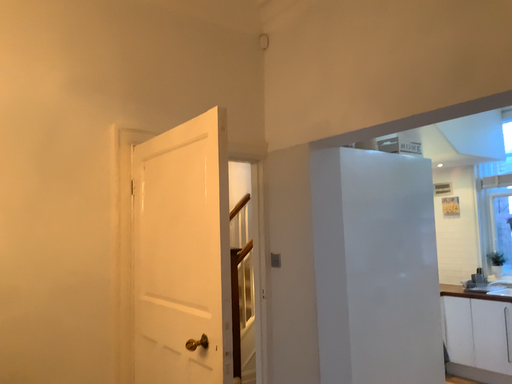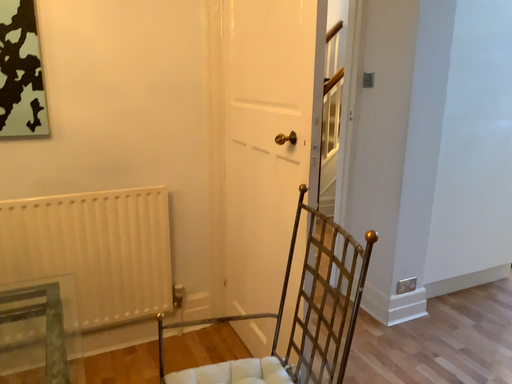
Question: How did the camera likely rotate when shooting the video?

Choices:
 (A) rotated right
 (B) rotated left

Answer: (B)